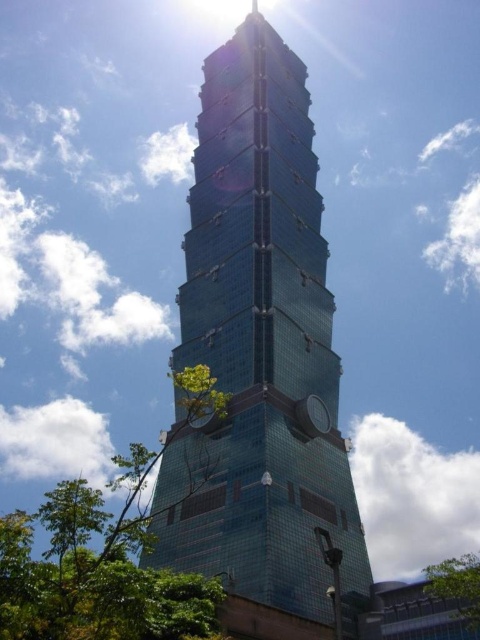
Is glassy blue skyscraper at center above green leafy tree at lower left?

Yes, glassy blue skyscraper at center is above green leafy tree at lower left.

Who is taller, glassy blue skyscraper at center or green leafy tree at lower left?

With more height is glassy blue skyscraper at center.

Is point (200, 435) closer to camera compared to point (134, 545)?

No, (200, 435) is behind (134, 545).

You are a GUI agent. You are given a task and a screenshot of the screen. Output one action in this format:
    pyautogui.click(x=<x>, y=<y>)
    Task: Click on the glassy blue skyscraper at center
    This screenshot has width=480, height=640.
    Given the screenshot: What is the action you would take?
    pyautogui.click(x=260, y=349)

Is green leafy tree at lower left shorter than green leafy tree at lower right?

Incorrect, green leafy tree at lower left's height does not fall short of green leafy tree at lower right's.

This screenshot has width=480, height=640. I want to click on green leafy tree at lower left, so click(x=96, y=570).

Is glassy blue skyscraper at center bigger than green leafy tree at lower right?

Yes.

Does glassy blue skyscraper at center lie behind green leafy tree at lower right?

That is False.

Which is in front, point (255, 154) or point (448, 589)?

Point (448, 589) is in front.

Image resolution: width=480 pixels, height=640 pixels. I want to click on glassy blue skyscraper at center, so [x=260, y=349].